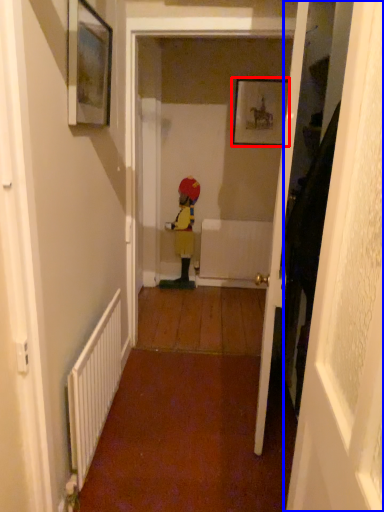
Question: Which object appears farthest to the camera in this image, picture frame (highlighted by a red box) or door (highlighted by a blue box)?

Choices:
 (A) picture frame
 (B) door

Answer: (A)